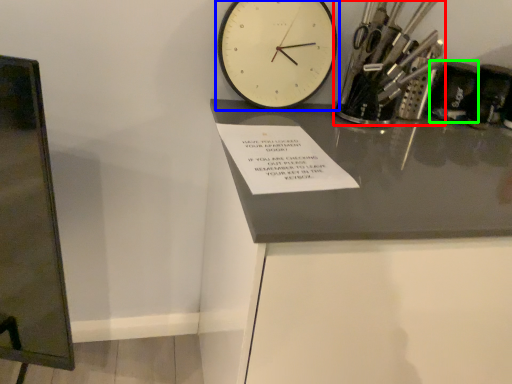
Question: Which object is positioned closest to stationery (highlighted by a red box)? Select from wall clock (highlighted by a blue box) and stationery (highlighted by a green box).

Choices:
 (A) wall clock
 (B) stationery

Answer: (B)